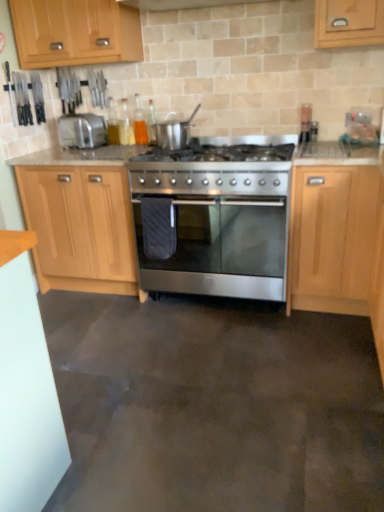
Identify the location of free location in front of silver metallic toaster at left. (64, 157).